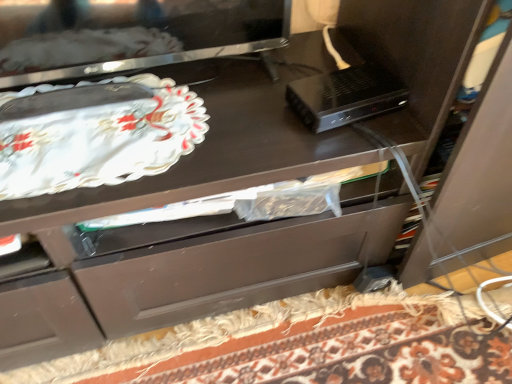
Question: Should I look upward or downward to see black plastic device at upper right?

Choices:
 (A) up
 (B) down

Answer: (A)